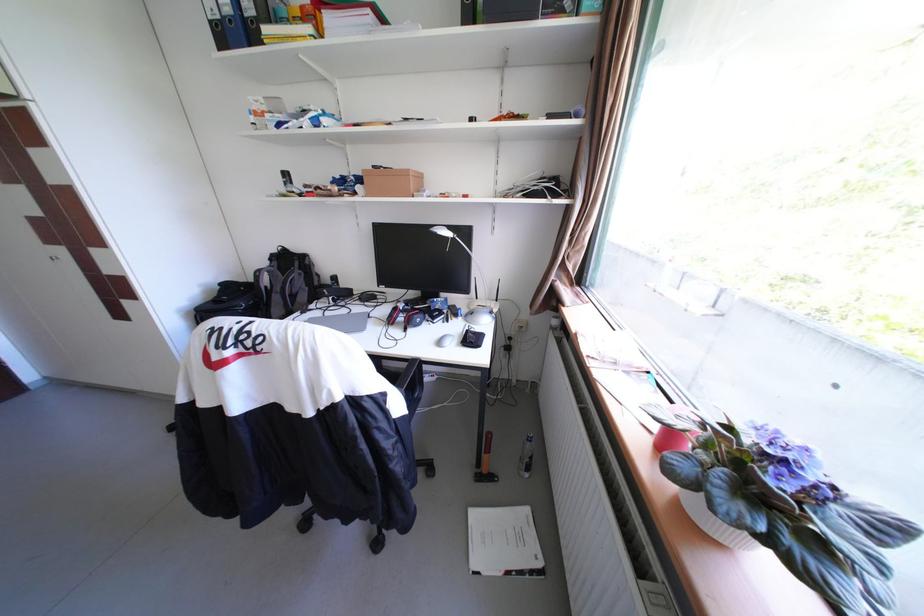
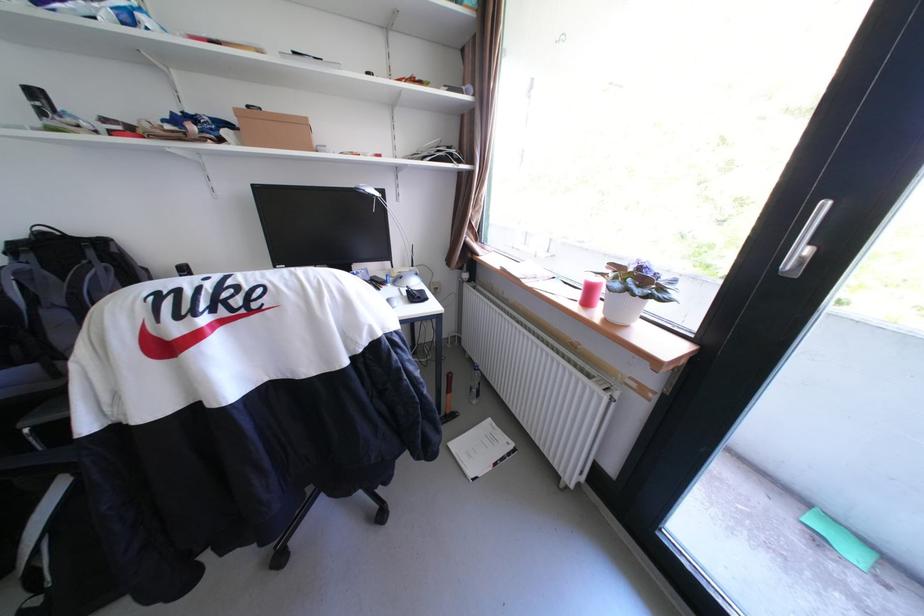
Find the pixel in the second image that matches (x=457, y=238) in the first image.

(382, 198)